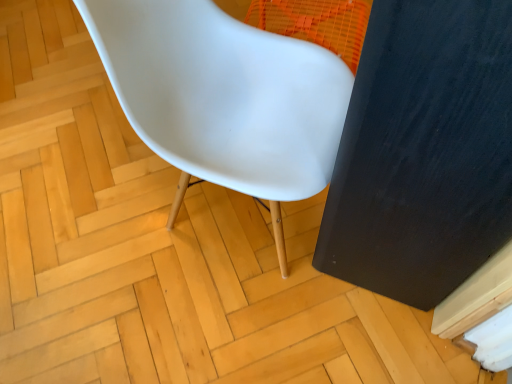
Question: Is white plastic chair at center shorter than black matte screen door at right?

Choices:
 (A) yes
 (B) no

Answer: (A)

Question: From the image's perspective, is white plastic chair at center on black matte screen door at right?

Choices:
 (A) no
 (B) yes

Answer: (B)

Question: Does white plastic chair at center have a greater height compared to black matte screen door at right?

Choices:
 (A) yes
 (B) no

Answer: (B)

Question: Is black matte screen door at right surrounded by white plastic chair at center?

Choices:
 (A) yes
 (B) no

Answer: (B)

Question: From a real-world perspective, is white plastic chair at center below black matte screen door at right?

Choices:
 (A) yes
 (B) no

Answer: (A)

Question: Is white plastic chair at center directly adjacent to black matte screen door at right?

Choices:
 (A) yes
 (B) no

Answer: (B)

Question: Is black matte screen door at right completely or partially outside of white plastic chair at center?

Choices:
 (A) no
 (B) yes

Answer: (B)

Question: Is black matte screen door at right thinner than white plastic chair at center?

Choices:
 (A) no
 (B) yes

Answer: (B)

Question: From a real-world perspective, is black matte screen door at right physically below white plastic chair at center?

Choices:
 (A) no
 (B) yes

Answer: (A)

Question: Is black matte screen door at right aimed at white plastic chair at center?

Choices:
 (A) no
 (B) yes

Answer: (B)

Question: Could white plastic chair at center be considered to be inside black matte screen door at right?

Choices:
 (A) yes
 (B) no

Answer: (B)

Question: Is white plastic chair at center at the back of black matte screen door at right?

Choices:
 (A) yes
 (B) no

Answer: (B)

Question: Is black matte screen door at right taller or shorter than white plastic chair at center?

Choices:
 (A) short
 (B) tall

Answer: (B)